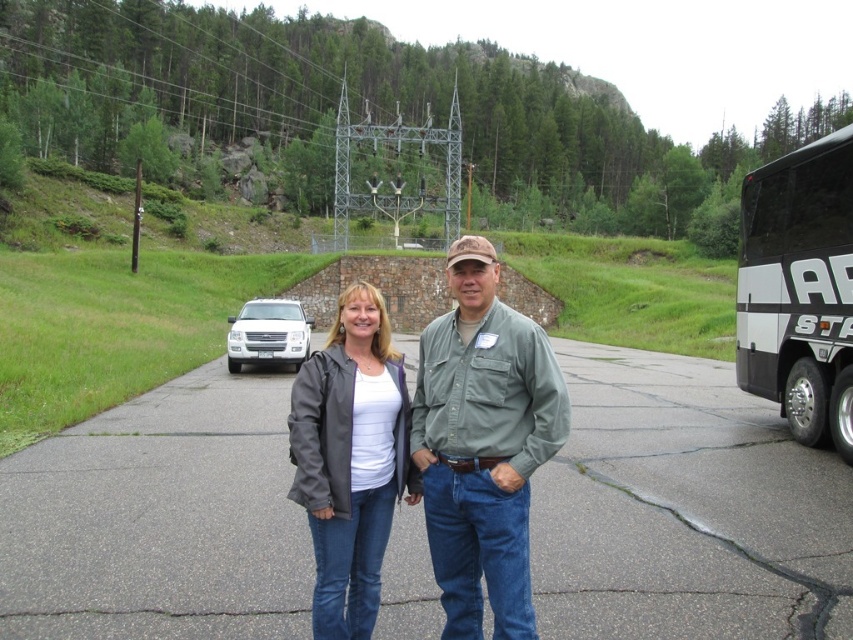
Is matte gray jacket at center above white matte suv at center?

Incorrect, matte gray jacket at center is not positioned above white matte suv at center.

Is matte gray jacket at center bigger than white matte suv at center?

Incorrect, matte gray jacket at center is not larger than white matte suv at center.

Image resolution: width=853 pixels, height=640 pixels. I want to click on matte gray jacket at center, so click(x=350, y=460).

This screenshot has height=640, width=853. I want to click on matte gray jacket at center, so click(x=350, y=460).

How distant is black/white bus at right from white matte suv at center?

black/white bus at right and white matte suv at center are 12.13 meters apart from each other.

Does black/white bus at right appear under white matte suv at center?

Incorrect, black/white bus at right is not positioned below white matte suv at center.

Describe the element at coordinates (799, 289) in the screenshot. I see `black/white bus at right` at that location.

You are a GUI agent. You are given a task and a screenshot of the screen. Output one action in this format:
    pyautogui.click(x=<x>, y=<y>)
    Task: Click on the black/white bus at right
    The height and width of the screenshot is (640, 853).
    Given the screenshot: What is the action you would take?
    pyautogui.click(x=799, y=289)

Does green cotton shirt at center have a larger size compared to matte gray jacket at center?

No.

Between green cotton shirt at center and matte gray jacket at center, which one appears on the right side from the viewer's perspective?

Positioned to the right is green cotton shirt at center.

Which is behind, point (410, 435) or point (343, 534)?

Point (410, 435)

Where is `green cotton shirt at center`? The height and width of the screenshot is (640, 853). green cotton shirt at center is located at coordinates (483, 444).